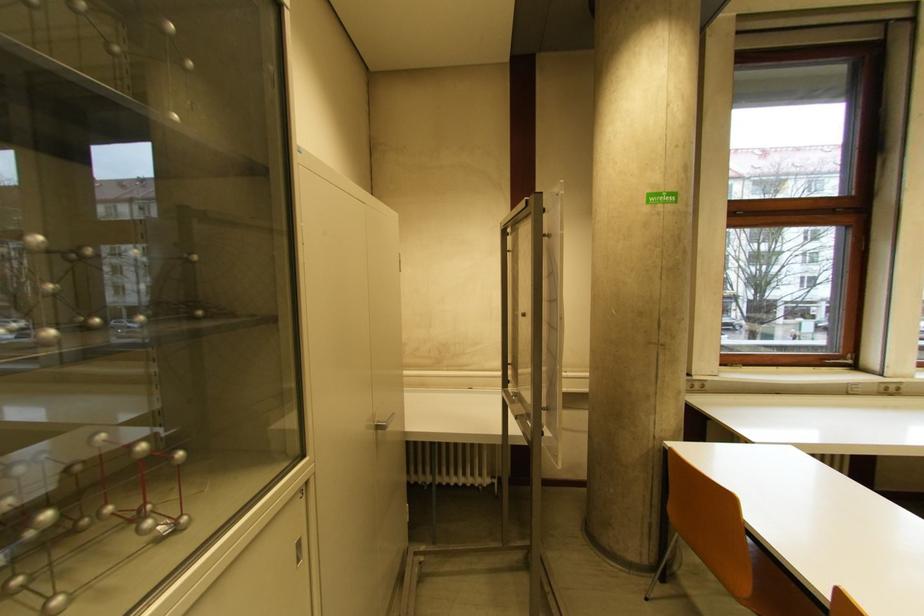
What do you see at coordinates (299, 551) in the screenshot?
I see `the recessed cabinet handle` at bounding box center [299, 551].